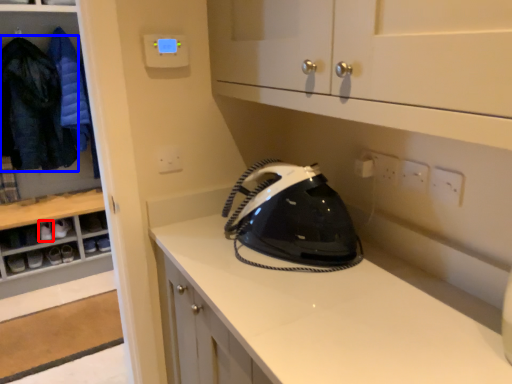
Question: Among these objects, which one is nearest to the camera, footwear (highlighted by a red box) or clothing (highlighted by a blue box)?

Choices:
 (A) footwear
 (B) clothing

Answer: (B)